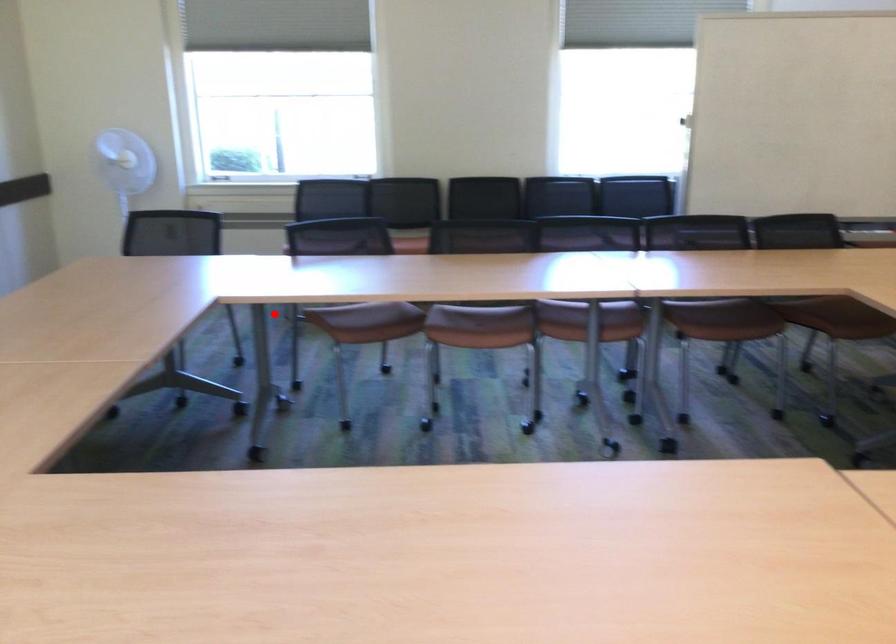
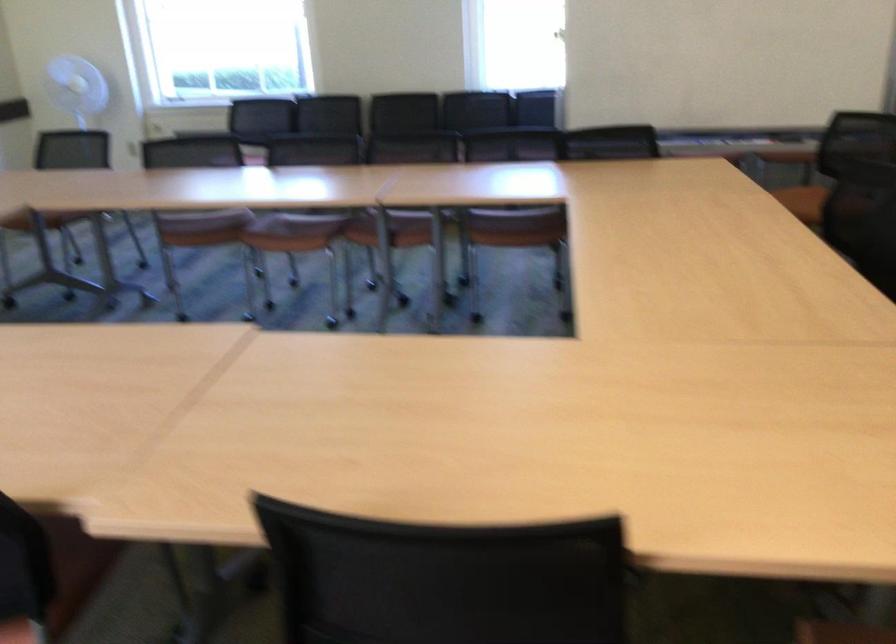
Question: I am providing you with two images of the same scene from different viewpoints. A red point is marked on the first image. At the location where the point appears in image 1, is it still visible in image 2?

Choices:
 (A) Yes
 (B) No

Answer: (B)